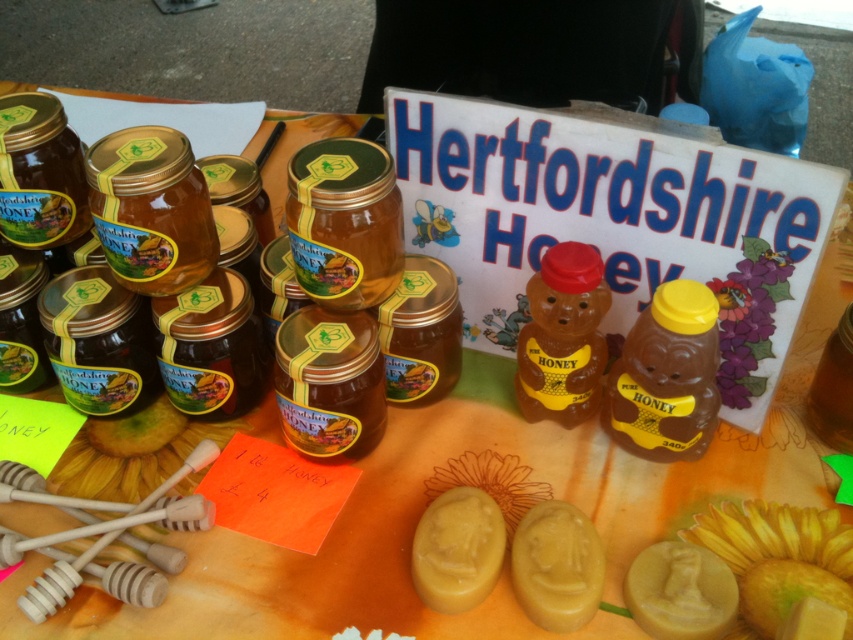
Question: Considering the real-world distances, which object is closest to the yellow matte honeycomb at center?

Choices:
 (A) yellow matte honey soap at center
 (B) yellow matte soap at center

Answer: (B)

Question: Considering the relative positions of yellow matte soap at center and yellow matte honeycomb at center in the image provided, where is yellow matte soap at center located with respect to yellow matte honeycomb at center?

Choices:
 (A) below
 (B) above

Answer: (A)

Question: Estimate the real-world distances between objects in this image. Which object is farther from the yellow matte honey soap at center?

Choices:
 (A) yellow matte honeycomb at center
 (B) yellow matte soap at center

Answer: (A)

Question: Estimate the real-world distances between objects in this image. Which object is farther from the yellow matte honeycomb at center?

Choices:
 (A) yellow matte honey soap at center
 (B) yellow matte soap at center

Answer: (A)

Question: Does yellow matte honeycomb at center appear on the right side of yellow matte honey soap at center?

Choices:
 (A) yes
 (B) no

Answer: (B)

Question: From the image, what is the correct spatial relationship of yellow matte soap at center in relation to yellow matte honey soap at center?

Choices:
 (A) above
 (B) below

Answer: (A)